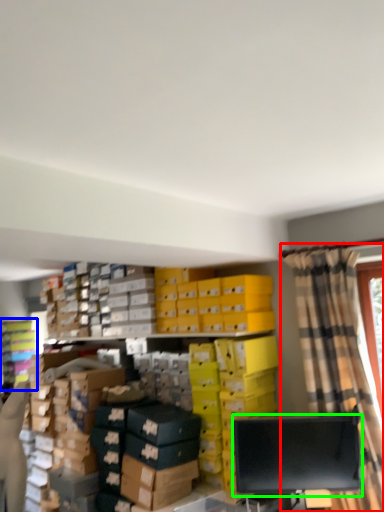
Question: Which object is the farthest from curtain (highlighted by a red box)? Choose among these: shelf (highlighted by a blue box) or computer monitor (highlighted by a green box).

Choices:
 (A) shelf
 (B) computer monitor

Answer: (A)